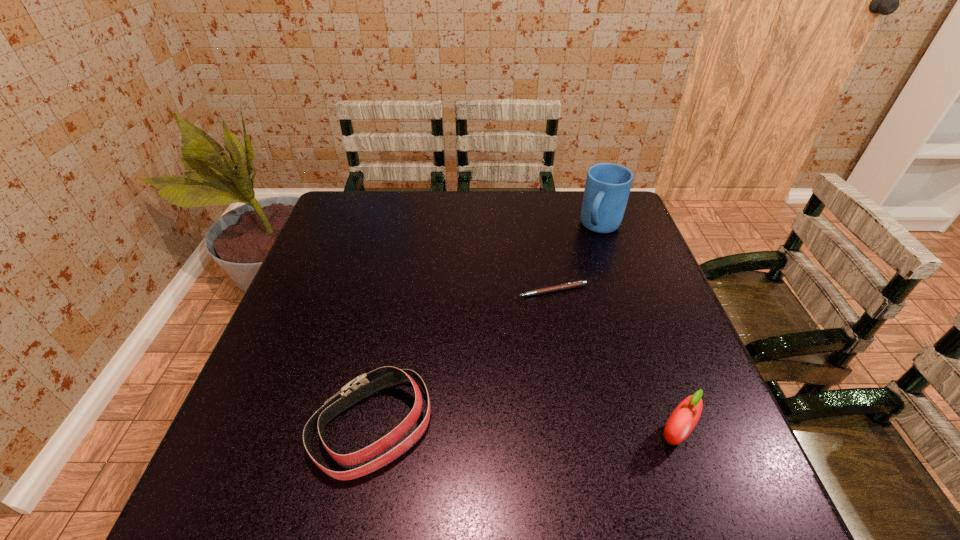
Where is `mug that is at the right edge`? mug that is at the right edge is located at coordinates click(x=607, y=188).

Identify the location of object present at the near left corner. (364, 385).

Identify the location of object located in the far right corner section of the desktop. The height and width of the screenshot is (540, 960). (607, 188).

At what (x,y) coordinates should I click in order to perform the action: click on object located in the near right corner section of the desktop. Please return your answer as a coordinate pair (x, y). This screenshot has width=960, height=540. Looking at the image, I should click on (684, 418).

Find the location of a particular element. vacant space at the far edge is located at coordinates (410, 193).

Identify the location of blank space at the near edge of the desktop. The width and height of the screenshot is (960, 540). (462, 454).

The height and width of the screenshot is (540, 960). I want to click on vacant space at the left edge of the desktop, so click(358, 256).

In the image, there is a desktop. At what (x,y) coordinates should I click in order to perform the action: click on free space at the right edge. Please return your answer as a coordinate pair (x, y). Looking at the image, I should click on (683, 393).

Find the location of a particular element. This screenshot has width=960, height=540. vacant space at the far left corner of the desktop is located at coordinates (343, 195).

I want to click on free space at the near left corner of the desktop, so click(246, 451).